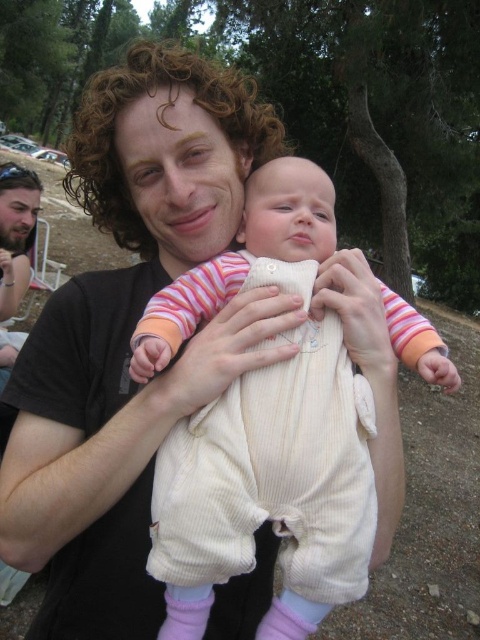
Question: From the image, what is the correct spatial relationship of white corduroy onesie at center in relation to cream corduroy baby at center?

Choices:
 (A) left
 (B) right

Answer: (B)

Question: Which point is closer to the camera?

Choices:
 (A) cream corduroy baby at center
 (B) white corduroy onesie at center

Answer: (B)

Question: Does white corduroy onesie at center have a lesser width compared to cream corduroy baby at center?

Choices:
 (A) yes
 (B) no

Answer: (A)

Question: Does white corduroy onesie at center appear over cream corduroy baby at center?

Choices:
 (A) no
 (B) yes

Answer: (B)

Question: Which point is farther to the camera?

Choices:
 (A) cream corduroy baby at center
 (B) white corduroy onesie at center

Answer: (A)